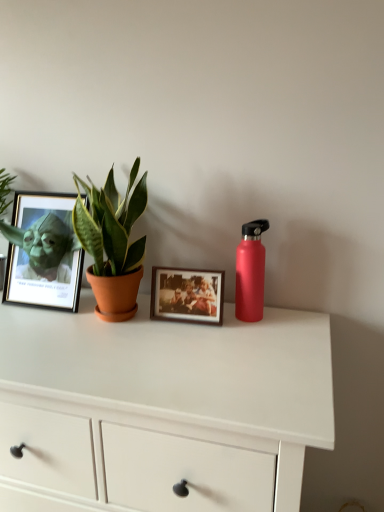
This screenshot has height=512, width=384. Find the location of `blank area to the left of green matte plant at left`. blank area to the left of green matte plant at left is located at coordinates (31, 322).